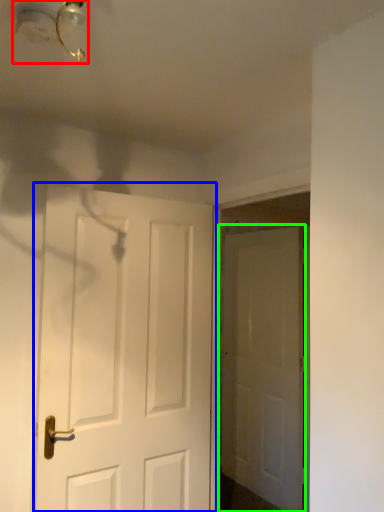
Question: Based on their relative distances, which object is farther from light fixture (highlighted by a red box)? Choose from door (highlighted by a blue box) and door (highlighted by a green box).

Choices:
 (A) door
 (B) door

Answer: (B)